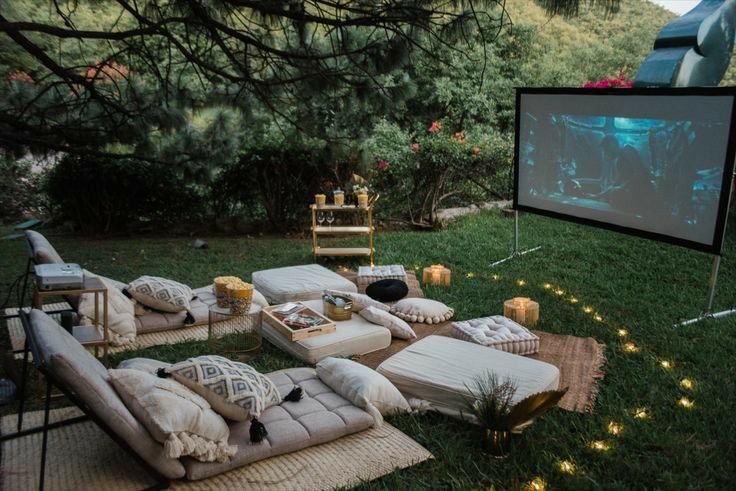
This screenshot has width=736, height=491. Identify the location of pillows. (182, 410), (233, 389), (358, 382), (375, 323), (364, 298), (414, 305), (397, 292), (480, 327), (166, 285), (116, 305).